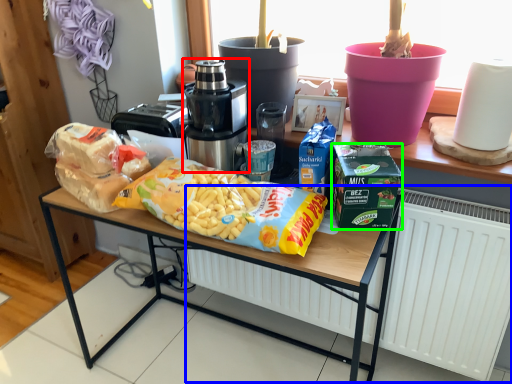
Question: Which is farther away from home appliance (highlighted by a red box)? radiator (highlighted by a blue box) or lunch box (highlighted by a green box)?

Choices:
 (A) radiator
 (B) lunch box

Answer: (A)